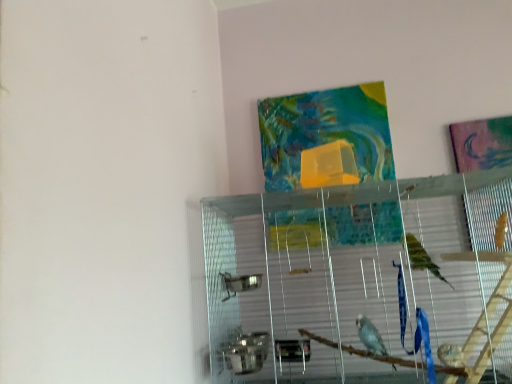
Question: Looking at the image, does textured fabric tapestry at upper center seem bigger or smaller compared to clear glass cage at center?

Choices:
 (A) big
 (B) small

Answer: (B)

Question: In terms of width, does textured fabric tapestry at upper center look wider or thinner when compared to clear glass cage at center?

Choices:
 (A) thin
 (B) wide

Answer: (A)

Question: Would you say textured fabric tapestry at upper center is inside or outside clear glass cage at center?

Choices:
 (A) inside
 (B) outside

Answer: (B)

Question: In terms of height, does clear glass cage at center look taller or shorter compared to textured fabric tapestry at upper center?

Choices:
 (A) tall
 (B) short

Answer: (A)

Question: Considering the positions of clear glass cage at center and textured fabric tapestry at upper center in the image, is clear glass cage at center bigger or smaller than textured fabric tapestry at upper center?

Choices:
 (A) big
 (B) small

Answer: (A)

Question: Considering the relative positions of clear glass cage at center and textured fabric tapestry at upper center in the image provided, is clear glass cage at center to the left or to the right of textured fabric tapestry at upper center?

Choices:
 (A) left
 (B) right

Answer: (B)

Question: Is clear glass cage at center in front of or behind textured fabric tapestry at upper center in the image?

Choices:
 (A) behind
 (B) front

Answer: (B)